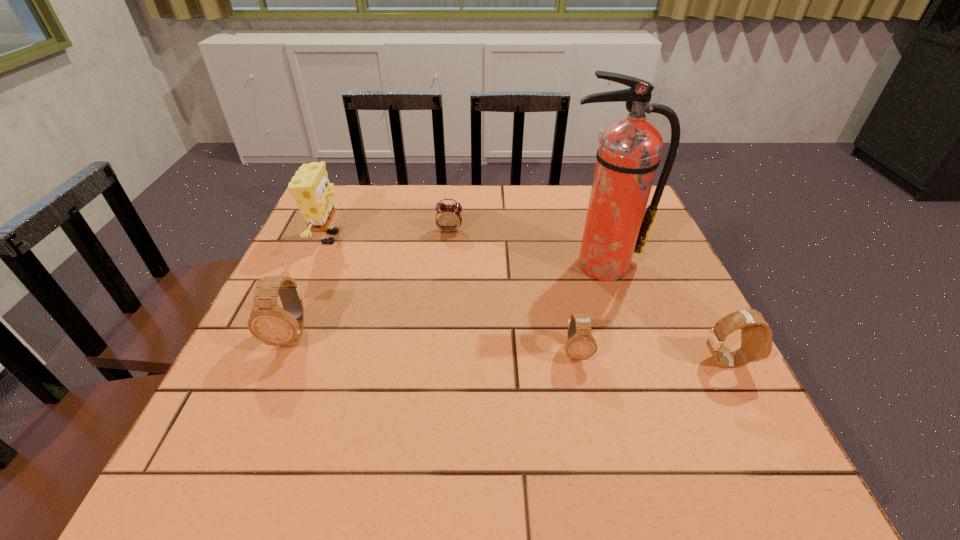
The image size is (960, 540). I want to click on free space between the sponge and the fire extinguisher, so click(465, 252).

Locate an element on the screen. This screenshot has width=960, height=540. free space between the fire extinguisher and the sponge is located at coordinates (465, 252).

Identify the location of vacant space in between the second watch from right to left and the alarm clock. Image resolution: width=960 pixels, height=540 pixels. (513, 292).

Identify the location of vacant area that lies between the third object from left to right and the fire extinguisher. This screenshot has width=960, height=540. (525, 248).

The image size is (960, 540). Find the location of `free space that is in between the fire extinguisher and the leftmost watch`. free space that is in between the fire extinguisher and the leftmost watch is located at coordinates (446, 300).

What are the coordinates of `the fifth closest object relative to the third tallest object` in the screenshot? It's located at (756, 336).

Select which object is the closest to the sponge. Please provide its 2D coordinates. Your answer should be formatted as a tuple, i.e. [(x, y)], where the tuple contains the x and y coordinates of a point satisfying the conditions above.

[(268, 322)]

Identify which watch is the second closest to the second watch from right to left. Please provide its 2D coordinates. Your answer should be formatted as a tuple, i.e. [(x, y)], where the tuple contains the x and y coordinates of a point satisfying the conditions above.

[(268, 322)]

Select which watch appears as the second closest to the fire extinguisher. Please provide its 2D coordinates. Your answer should be formatted as a tuple, i.e. [(x, y)], where the tuple contains the x and y coordinates of a point satisfying the conditions above.

[(756, 336)]